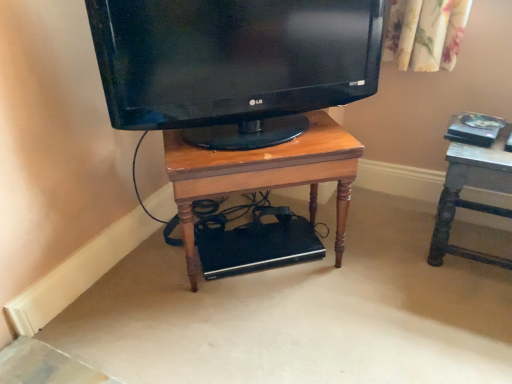
You are a GUI agent. You are given a task and a screenshot of the screen. Output one action in this format:
    pyautogui.click(x=<x>, y=<y>)
    Task: Click on the free space between wooden desk at center and wooden table at right
    Image resolution: width=512 pixels, height=384 pixels.
    Given the screenshot: What is the action you would take?
    pyautogui.click(x=377, y=253)